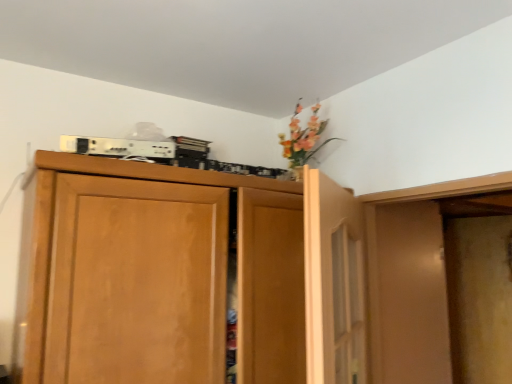
Question: Is wooden cupboard at upper center in front of or behind wooden door at upper center in the image?

Choices:
 (A) behind
 (B) front

Answer: (A)

Question: From a real-world perspective, is wooden cupboard at upper center physically located above or below wooden door at upper center?

Choices:
 (A) above
 (B) below

Answer: (B)

Question: Is wooden cupboard at upper center taller or shorter than wooden door at upper center?

Choices:
 (A) short
 (B) tall

Answer: (B)

Question: Is point (331, 364) closer or farther from the camera than point (172, 332)?

Choices:
 (A) farther
 (B) closer

Answer: (B)

Question: From a real-world perspective, is wooden door at upper center above or below wooden cupboard at upper center?

Choices:
 (A) above
 (B) below

Answer: (A)

Question: Based on their sizes in the image, would you say wooden door at upper center is bigger or smaller than wooden cupboard at upper center?

Choices:
 (A) small
 (B) big

Answer: (A)

Question: Based on their positions, is wooden door at upper center located to the left or right of wooden cupboard at upper center?

Choices:
 (A) left
 (B) right

Answer: (B)